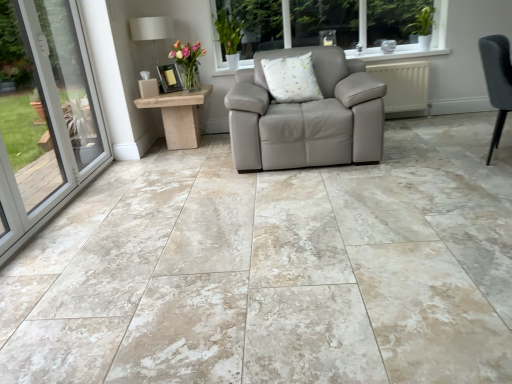
The height and width of the screenshot is (384, 512). What are the coordinates of `free space in front of wooden side table at left` in the screenshot? It's located at (148, 165).